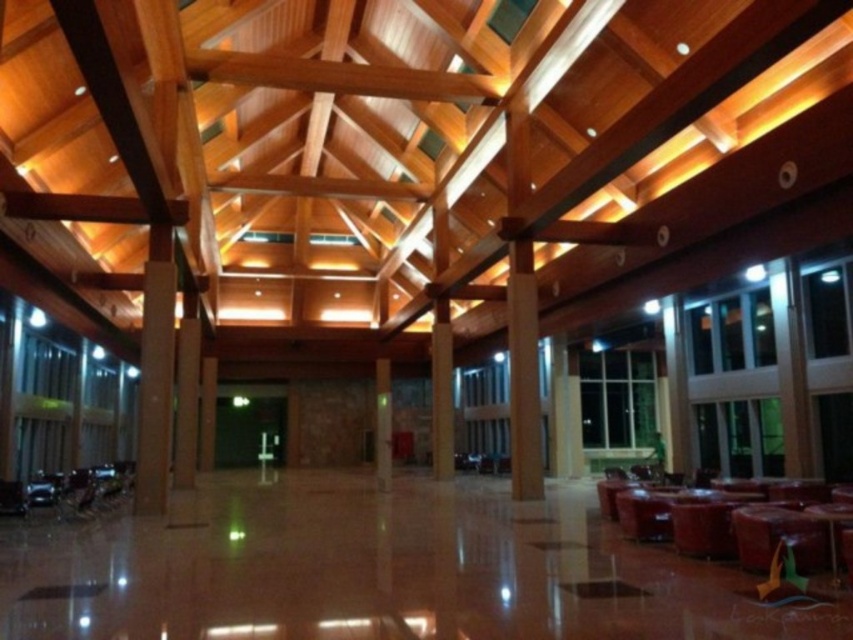
I want to click on wooden beam at center, so click(523, 372).

What do you see at coordinates (523, 372) in the screenshot? I see `wooden beam at center` at bounding box center [523, 372].

Does point (531, 374) lie behind point (206, 416)?

No, (531, 374) is closer to viewer.

The width and height of the screenshot is (853, 640). I want to click on wooden beam at center, so click(523, 372).

Does brown polished wood pillar at center have a smaller size compared to brown polished pillar at center?

Correct, brown polished wood pillar at center occupies less space than brown polished pillar at center.

This screenshot has height=640, width=853. What do you see at coordinates (440, 392) in the screenshot?
I see `brown polished wood pillar at center` at bounding box center [440, 392].

Find the location of a particular element. This screenshot has height=640, width=853. brown polished wood pillar at center is located at coordinates (440, 392).

Is the position of satin gold column at center less distant than that of brown polished pillar at center?

Yes.

You are a GUI agent. You are given a task and a screenshot of the screen. Output one action in this format:
    pyautogui.click(x=<x>, y=<y>)
    Task: Click on the satin gold column at center
    
    Given the screenshot: What is the action you would take?
    pyautogui.click(x=155, y=372)

The image size is (853, 640). Find the location of `satin gold column at center`. satin gold column at center is located at coordinates (155, 372).